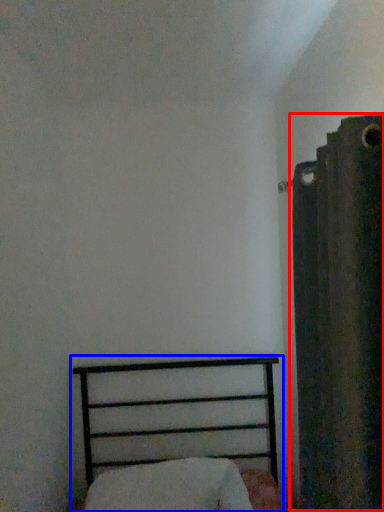
Question: Which of the following is the closest to the observer, curtain (highlighted by a red box) or bed (highlighted by a blue box)?

Choices:
 (A) curtain
 (B) bed

Answer: (A)